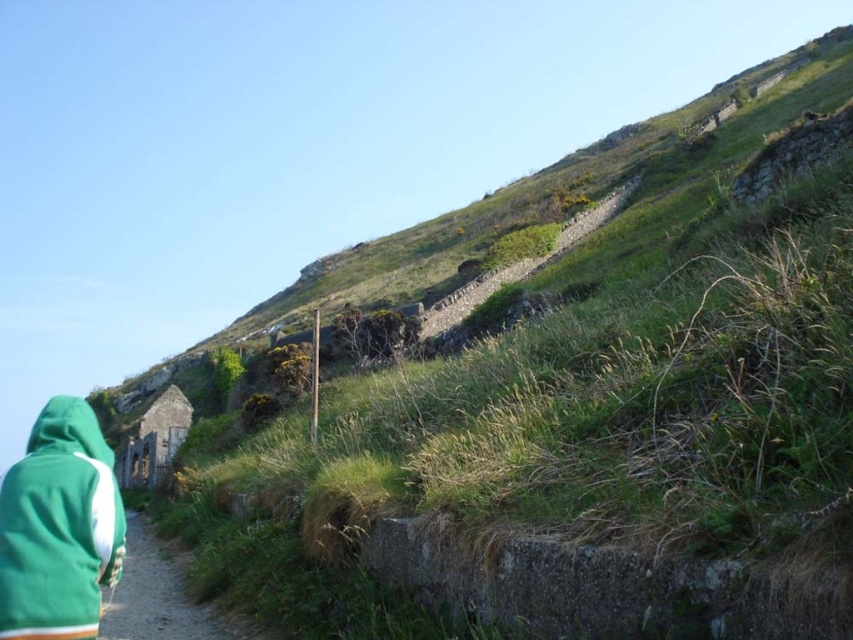
Question: Is green fleece sweatshirt at lower left wider than green fabric at lower left?

Choices:
 (A) yes
 (B) no

Answer: (B)

Question: Which point is farther to the camera?

Choices:
 (A) (77, 432)
 (B) (149, 605)

Answer: (B)

Question: Which point is farther to the camera?

Choices:
 (A) (13, 465)
 (B) (213, 616)

Answer: (B)

Question: In this image, where is green fleece sweatshirt at lower left located relative to green fabric at lower left?

Choices:
 (A) right
 (B) left

Answer: (A)

Question: Is the position of green fleece sweatshirt at lower left more distant than that of green fabric at lower left?

Choices:
 (A) no
 (B) yes

Answer: (A)